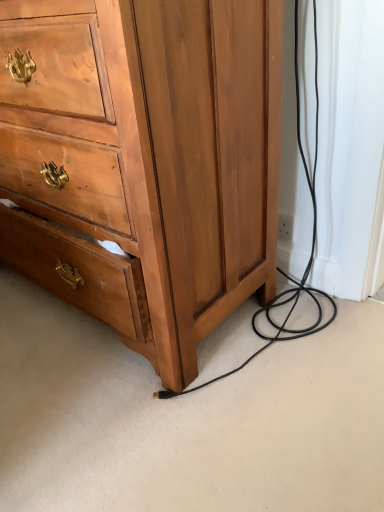
Where is `matte wood chest of drawers at center`? matte wood chest of drawers at center is located at coordinates (144, 161).

This screenshot has height=512, width=384. Describe the element at coordinates (144, 161) in the screenshot. I see `matte wood chest of drawers at center` at that location.

I want to click on matte wood chest of drawers at center, so click(x=144, y=161).